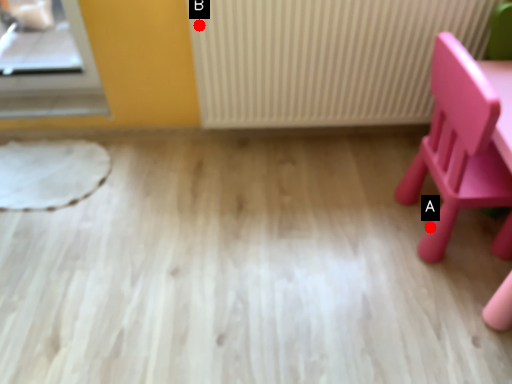
Question: Two points are circled on the image, labeled by A and B beside each circle. Which point appears farthest from the camera in this image?

Choices:
 (A) A is further
 (B) B is further

Answer: (A)